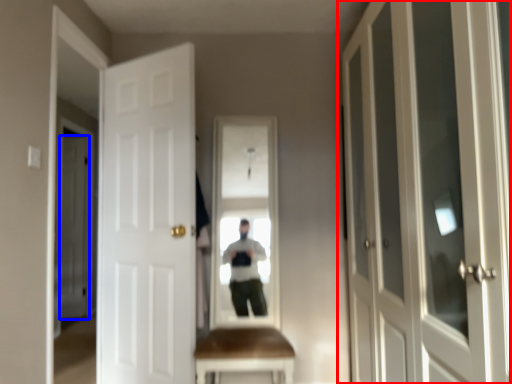
Question: Which of the following is the farthest to the observer, door (highlighted by a red box) or door (highlighted by a blue box)?

Choices:
 (A) door
 (B) door

Answer: (B)